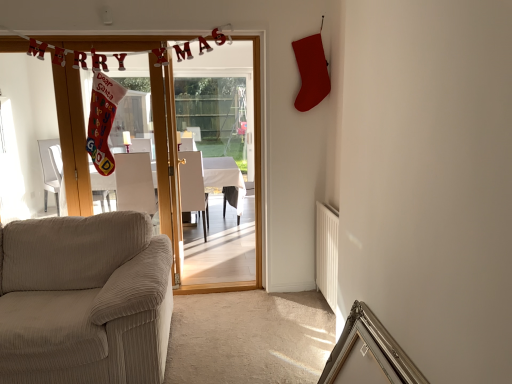
Find the location of a particular element. The image size is (512, 384). white glossy table at center is located at coordinates (225, 178).

What do you see at coordinates (368, 354) in the screenshot? This screenshot has height=384, width=512. I see `silver metallic picture frame at lower right` at bounding box center [368, 354].

Identify the location of beige corduroy couch at lower left. (82, 300).

Where is `white fabric armchair at center, which is the second armchair in left-to-right order`? white fabric armchair at center, which is the second armchair in left-to-right order is located at coordinates (193, 185).

What do you see at coordinates (134, 183) in the screenshot?
I see `white corduroy armchair at center, acting as the 2th armchair starting from the right` at bounding box center [134, 183].

What do you see at coordinates (255, 180) in the screenshot? This screenshot has width=512, height=384. I see `wooden door at center` at bounding box center [255, 180].

Find the location of `white glossy table at center`. white glossy table at center is located at coordinates (225, 178).

Between white corduroy armchair at center, acting as the 2th armchair starting from the right, and wooden door at center, which one appears on the right side from the viewer's perspective?

wooden door at center is more to the right.

Based on the photo, is white corduroy armchair at center, which is counted as the 1th armchair, starting from the left, closer to camera compared to wooden door at center?

That is False.

I want to click on armchair that appears on the left of wooden door at center, so click(x=134, y=183).

Considering the points (126, 200) and (174, 209), which point is in front, point (126, 200) or point (174, 209)?

Positioned in front is point (174, 209).

Which point is more distant from viewer, (x=243, y=187) or (x=361, y=346)?

The point (x=243, y=187) is behind.

Could you tell me if white glossy table at center is facing silver metallic picture frame at lower right?

No, white glossy table at center is not facing towards silver metallic picture frame at lower right.

Locate an element on the screen. The width and height of the screenshot is (512, 384). table that is behind the silver metallic picture frame at lower right is located at coordinates (225, 178).

Is white glossy table at center wider than silver metallic picture frame at lower right?

Yes.

Can you confirm if beige corduroy couch at lower left is taller than wooden door at center?

In fact, beige corduroy couch at lower left may be shorter than wooden door at center.

Is the surface of beige corduroy couch at lower left in direct contact with wooden door at center?

No.

Considering the relative sizes of beige corduroy couch at lower left and wooden door at center in the image provided, is beige corduroy couch at lower left smaller than wooden door at center?

Actually, beige corduroy couch at lower left might be larger than wooden door at center.

Does beige corduroy couch at lower left lie in front of wooden door at center?

Yes, it is.

Can you confirm if wooden door at center is taller than silver metallic picture frame at lower right?

Yes, wooden door at center is taller than silver metallic picture frame at lower right.

Is wooden door at center oriented towards silver metallic picture frame at lower right?

Yes.

From a real-world perspective, relative to silver metallic picture frame at lower right, is wooden door at center vertically above or below?

In terms of real-world spatial position, wooden door at center is above silver metallic picture frame at lower right.

In order to click on picture frame below the wooden door at center (from a real-world perspective) in this screenshot , I will do `click(368, 354)`.

Does point (388, 347) come in front of point (188, 204)?

Yes, it is in front of point (188, 204).

Does silver metallic picture frame at lower right have a lesser height compared to white fabric armchair at center, which is the second armchair in left-to-right order?

Correct, silver metallic picture frame at lower right is not as tall as white fabric armchair at center, which is the second armchair in left-to-right order.

From a real-world perspective, is silver metallic picture frame at lower right positioned over white fabric armchair at center, which is the second armchair in left-to-right order, based on gravity?

No, from a real-world perspective, silver metallic picture frame at lower right is not on top of white fabric armchair at center, which is the second armchair in left-to-right order.

In order to click on the 1st armchair above the silver metallic picture frame at lower right (from a real-world perspective) in this screenshot , I will do `click(193, 185)`.

Where is `door on the left of white fabric armchair at center, positioned as the 1th armchair in right-to-left order`? The image size is (512, 384). door on the left of white fabric armchair at center, positioned as the 1th armchair in right-to-left order is located at coordinates (255, 180).

From the image's perspective, is white fabric armchair at center, which is the second armchair in left-to-right order, under wooden door at center?

Indeed, from the image's perspective, white fabric armchair at center, which is the second armchair in left-to-right order, is shown beneath wooden door at center.

What's the angular difference between white fabric armchair at center, which is the second armchair in left-to-right order, and wooden door at center's facing directions?

177 degrees separate the facing orientations of white fabric armchair at center, which is the second armchair in left-to-right order, and wooden door at center.

Is white fabric armchair at center, positioned as the 1th armchair in right-to-left order, facing away from wooden door at center?

Absolutely, white fabric armchair at center, positioned as the 1th armchair in right-to-left order, is directed away from wooden door at center.

Locate an element on the screen. The image size is (512, 384). picture frame below the white corduroy armchair at center, acting as the 2th armchair starting from the right (from a real-world perspective) is located at coordinates (368, 354).

Considering their positions, is white corduroy armchair at center, which is counted as the 1th armchair, starting from the left, located in front of or behind silver metallic picture frame at lower right?

Visually, white corduroy armchair at center, which is counted as the 1th armchair, starting from the left, is located behind silver metallic picture frame at lower right.

Considering the relative positions of white corduroy armchair at center, acting as the 2th armchair starting from the right, and silver metallic picture frame at lower right in the image provided, is white corduroy armchair at center, acting as the 2th armchair starting from the right, to the left of silver metallic picture frame at lower right from the viewer's perspective?

Indeed, white corduroy armchair at center, acting as the 2th armchair starting from the right, is positioned on the left side of silver metallic picture frame at lower right.

This screenshot has height=384, width=512. I want to click on door below the white corduroy armchair at center, acting as the 2th armchair starting from the right (from the image's perspective), so click(255, 180).

This screenshot has height=384, width=512. In order to click on picture frame on the right of the white glossy table at center in this screenshot , I will do `click(368, 354)`.

Considering their positions, is beige corduroy couch at lower left positioned further to wooden door at center than white fabric armchair at center, positioned as the 1th armchair in right-to-left order?

Among the two, white fabric armchair at center, positioned as the 1th armchair in right-to-left order, is located further to wooden door at center.

From the image, which object appears to be farther from white glossy table at center, beige corduroy couch at lower left or silver metallic picture frame at lower right?

silver metallic picture frame at lower right is positioned further to the anchor white glossy table at center.

Estimate the real-world distances between objects in this image. Which object is further from silver metallic picture frame at lower right, beige corduroy couch at lower left or white glossy table at center?

Based on the image, white glossy table at center appears to be further to silver metallic picture frame at lower right.

Which object lies nearer to the anchor point beige corduroy couch at lower left, white corduroy armchair at center, acting as the 2th armchair starting from the right, or white fabric armchair at center, which is the second armchair in left-to-right order?

white corduroy armchair at center, acting as the 2th armchair starting from the right, lies closer to beige corduroy couch at lower left than the other object.

Which object lies nearer to the anchor point white fabric armchair at center, positioned as the 1th armchair in right-to-left order, silver metallic picture frame at lower right or white corduroy armchair at center, which is counted as the 1th armchair, starting from the left?

white corduroy armchair at center, which is counted as the 1th armchair, starting from the left, lies closer to white fabric armchair at center, positioned as the 1th armchair in right-to-left order, than the other object.

When comparing their distances from white glossy table at center, does wooden door at center or silver metallic picture frame at lower right seem further?

silver metallic picture frame at lower right.

Looking at the image, which one is located further to white glossy table at center, white corduroy armchair at center, acting as the 2th armchair starting from the right, or wooden door at center?

wooden door at center lies further to white glossy table at center than the other object.

Estimate the real-world distances between objects in this image. Which object is closer to wooden door at center, beige corduroy couch at lower left or white glossy table at center?

beige corduroy couch at lower left lies closer to wooden door at center than the other object.

The image size is (512, 384). I want to click on table between white corduroy armchair at center, acting as the 2th armchair starting from the right, and white fabric armchair at center, which is the second armchair in left-to-right order, in the horizontal direction, so click(225, 178).

I want to click on studio couch located between silver metallic picture frame at lower right and white corduroy armchair at center, acting as the 2th armchair starting from the right, in the depth direction, so click(x=82, y=300).

Locate an element on the screen. door between beige corduroy couch at lower left and silver metallic picture frame at lower right from left to right is located at coordinates pos(255,180).

At what (x,y) coordinates should I click in order to perform the action: click on studio couch located between silver metallic picture frame at lower right and white fabric armchair at center, positioned as the 1th armchair in right-to-left order, in the depth direction. Please return your answer as a coordinate pair (x, y). Looking at the image, I should click on (82, 300).